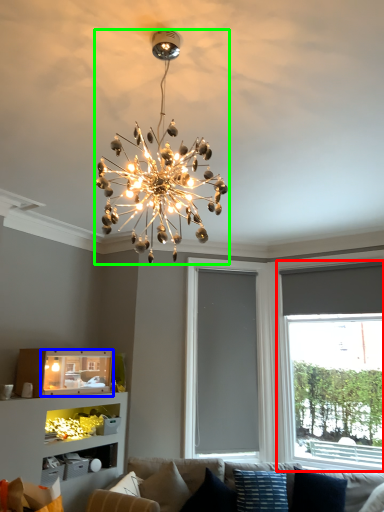
Question: Which object is the closest to the window (highlighted by a red box)? Choose among these: shelf (highlighted by a blue box) or lamp (highlighted by a green box).

Choices:
 (A) shelf
 (B) lamp

Answer: (A)